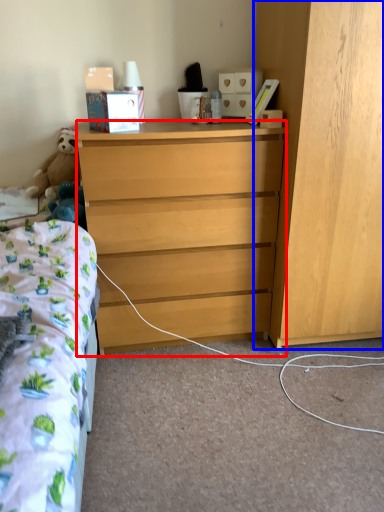
Question: Which object appears farthest to the camera in this image, desk (highlighted by a red box) or cabinetry (highlighted by a blue box)?

Choices:
 (A) desk
 (B) cabinetry

Answer: (A)